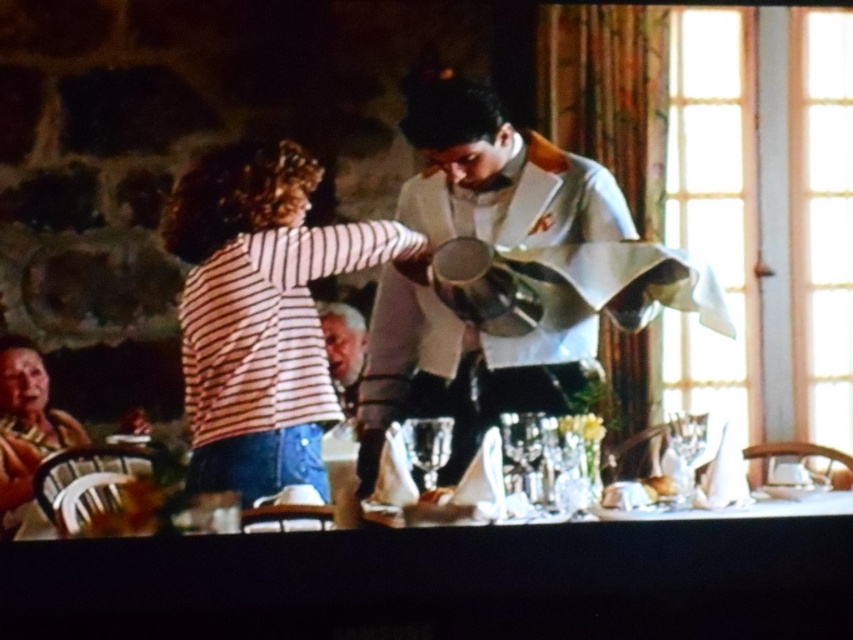
Which is in front, point (379, 413) or point (430, 422)?

Positioned in front is point (430, 422).

Which is behind, point (534, 227) or point (409, 454)?

Positioned behind is point (534, 227).

You are a GUI agent. You are given a task and a screenshot of the screen. Output one action in this format:
    pyautogui.click(x=<x>, y=<y>)
    Task: Click on the metallic silver pitcher at center
    
    Given the screenshot: What is the action you would take?
    pyautogui.click(x=508, y=276)

Is the position of white glossy table at center more distant than that of striped fabric shirt at center?

That is True.

Who is higher up, white glossy table at center or striped fabric shirt at center?

striped fabric shirt at center is above.

Identify the location of white glossy table at center. The width and height of the screenshot is (853, 640). (444, 582).

Where is `white glossy table at center`? The height and width of the screenshot is (640, 853). white glossy table at center is located at coordinates (444, 582).

Does white glossy table at center appear under metallic silver pitcher at center?

Yes, white glossy table at center is below metallic silver pitcher at center.

Is white glossy table at center closer to camera compared to metallic silver pitcher at center?

No.

I want to click on white glossy table at center, so click(444, 582).